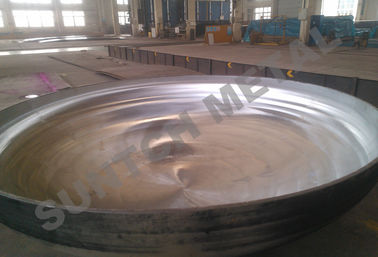
At what (x,y) coordinates should I click in order to perform the action: click on the longest window. Please return your answer as a coordinate pair (x, y). Looking at the image, I should click on (49, 17), (36, 17), (20, 17).